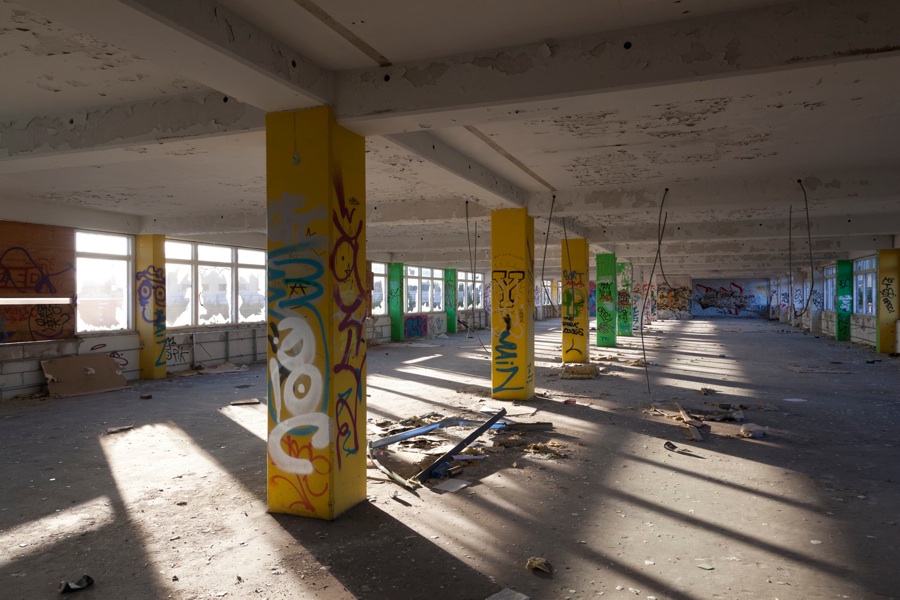
You are a GUI agent. You are given a task and a screenshot of the screen. Output one action in this format:
    pyautogui.click(x=<x>, y=<y>)
    Task: Click on the ceiling
    The image size is (900, 600).
    Given the screenshot: What is the action you would take?
    pyautogui.click(x=425, y=16), pyautogui.click(x=186, y=66), pyautogui.click(x=202, y=171), pyautogui.click(x=578, y=162)